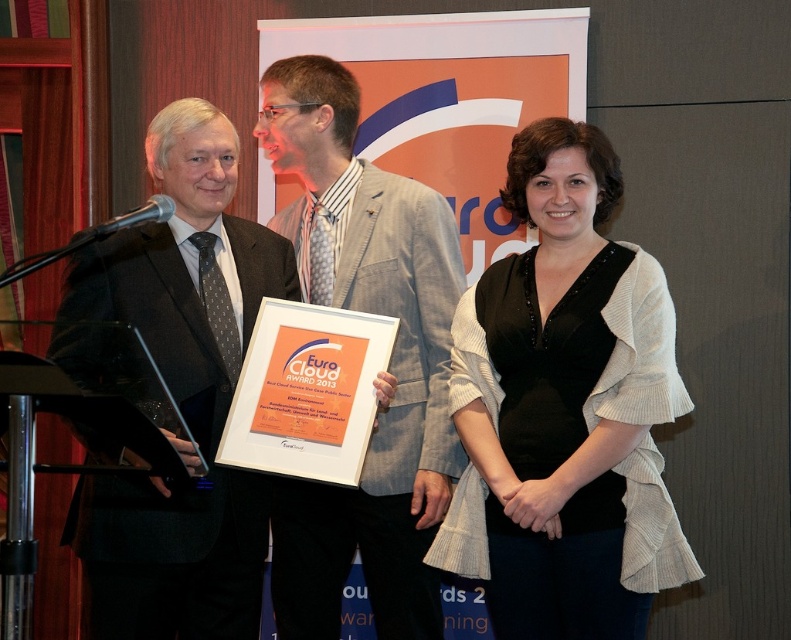
Can you confirm if black textured sweater at center is taller than matte black suit at center?

No.

Locate an element on the screen. black textured sweater at center is located at coordinates (566, 410).

Find the location of `black textured sweater at center`. black textured sweater at center is located at coordinates (566, 410).

Which is in front, point (375, 557) or point (199, 568)?

Point (199, 568) is more forward.

Which is in front, point (369, 170) or point (218, 150)?

Point (218, 150)

Where is `light gray textured blazer at center`? light gray textured blazer at center is located at coordinates (388, 365).

Does black textured sweater at center appear under light gray textured blazer at center?

Yes.

Is black textured sweater at center wider than light gray textured blazer at center?

Correct, the width of black textured sweater at center exceeds that of light gray textured blazer at center.

Measure the distance between point (x=657, y=476) and camera.

The distance of point (x=657, y=476) from camera is 2.06 meters.

At what (x,y) coordinates should I click in order to perform the action: click on black textured sweater at center. Please return your answer as a coordinate pair (x, y). Looking at the image, I should click on (566, 410).